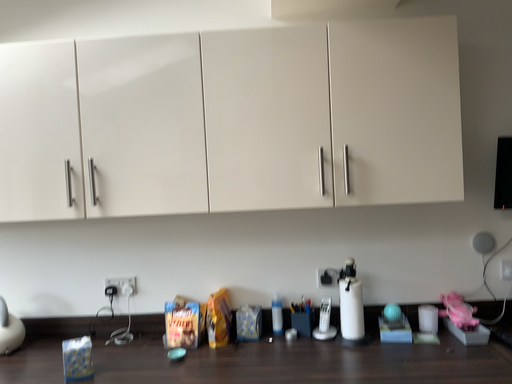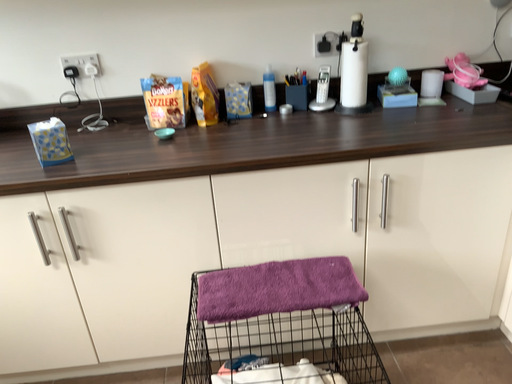
Question: How did the camera likely rotate when shooting the video?

Choices:
 (A) rotated right
 (B) rotated left

Answer: (A)